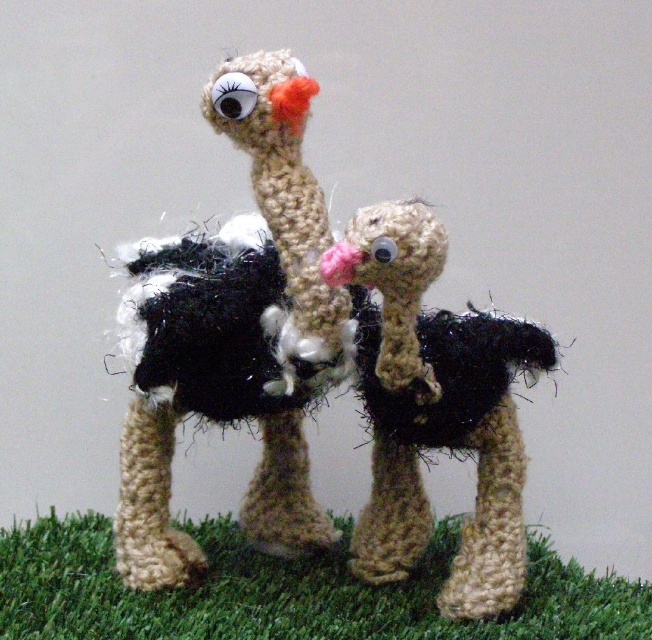
Question: Which point appears closest to the camera in this image?

Choices:
 (A) (196, 301)
 (B) (409, 493)

Answer: (A)

Question: Among these points, which one is nearest to the camera?

Choices:
 (A) (336, 604)
 (B) (342, 336)

Answer: (B)

Question: Considering the relative positions of green artificial turf at lower center and fuzzy black ostrich at center in the image provided, where is green artificial turf at lower center located with respect to fuzzy black ostrich at center?

Choices:
 (A) right
 (B) left

Answer: (B)

Question: Estimate the real-world distances between objects in this image. Which object is farther from the fuzzy black and white ostrich at center?

Choices:
 (A) green artificial turf at lower center
 (B) fuzzy black ostrich at center

Answer: (A)

Question: Is green artificial turf at lower center positioned before fuzzy black ostrich at center?

Choices:
 (A) no
 (B) yes

Answer: (A)

Question: Is green artificial turf at lower center positioned behind fuzzy black ostrich at center?

Choices:
 (A) yes
 (B) no

Answer: (A)